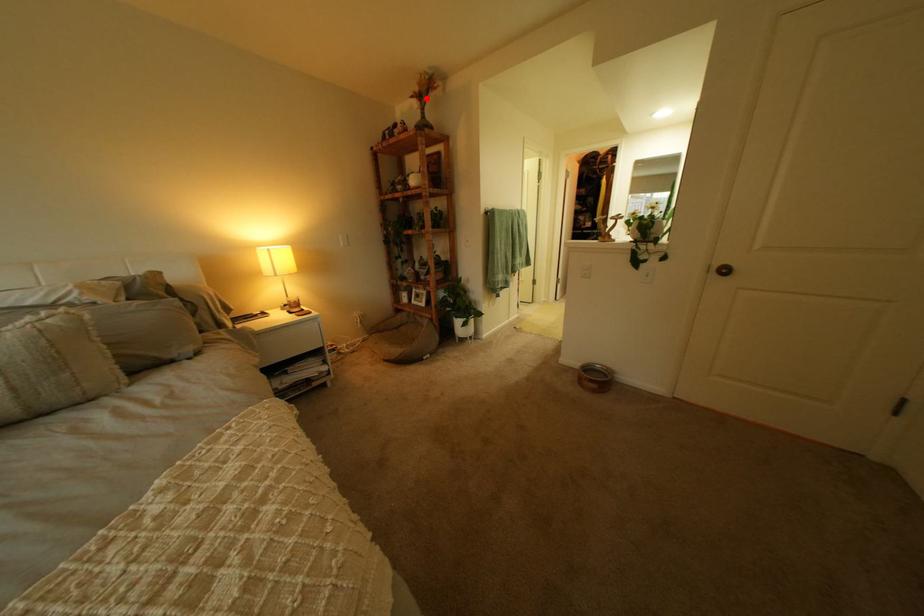
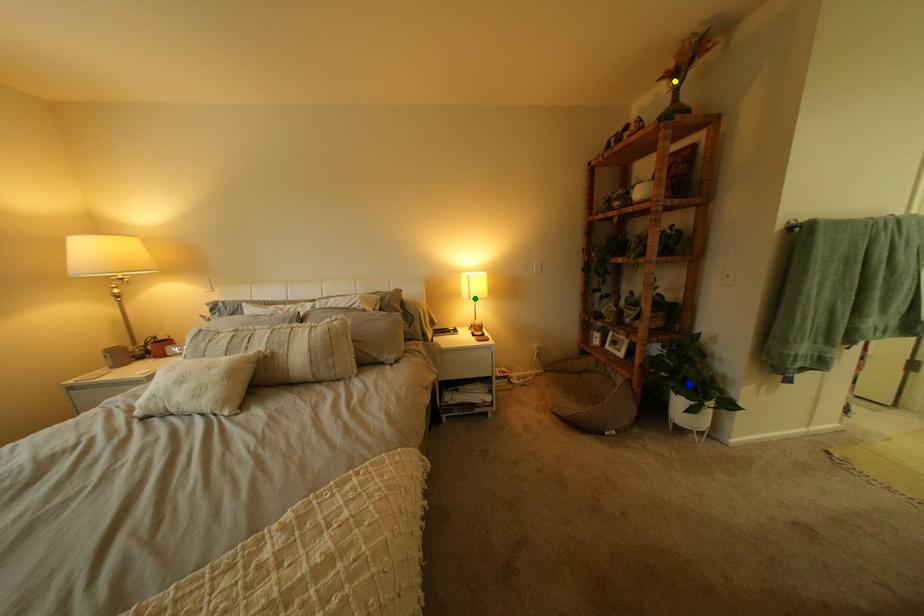
Question: I am providing you with two images of the same scene from different viewpoints. A red point is marked on the first image. You are given multiple points on the second image. Which spot in image 2 lines up with the point in image 1?

Choices:
 (A) blue point
 (B) yellow point
 (C) green point

Answer: (B)